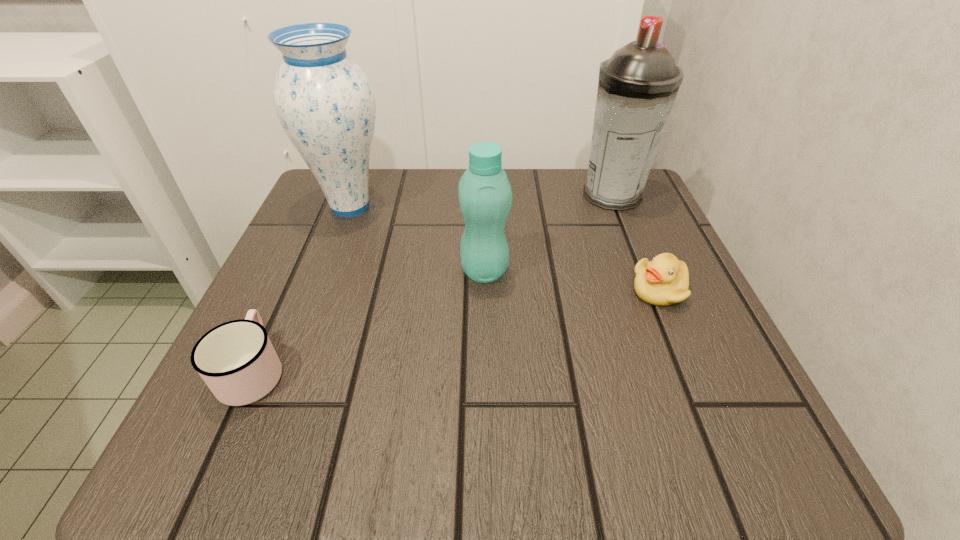
Locate an element on the screen. The width and height of the screenshot is (960, 540). aerosol can positioned at the right edge is located at coordinates (638, 84).

Locate an element on the screen. Image resolution: width=960 pixels, height=540 pixels. duckling positioned at the right edge is located at coordinates (663, 281).

Locate an element on the screen. object located at the far left corner is located at coordinates (325, 103).

Find the location of a particular element. object that is at the near left corner is located at coordinates (237, 361).

You are a GUI agent. You are given a task and a screenshot of the screen. Output one action in this format:
    pyautogui.click(x=<x>, y=<y>)
    Task: Click on the object located at the far right corner
    This screenshot has width=960, height=540.
    Given the screenshot: What is the action you would take?
    638,84

The height and width of the screenshot is (540, 960). I want to click on vacant space at the far edge of the desktop, so click(x=399, y=202).

At what (x,y) coordinates should I click in order to perform the action: click on free space at the near edge. Please return your answer as a coordinate pair (x, y). The width and height of the screenshot is (960, 540). Looking at the image, I should click on (x=373, y=469).

The width and height of the screenshot is (960, 540). In order to click on vacant space at the right edge of the desktop in this screenshot , I will do `click(692, 282)`.

Identify the location of vacant region at the far left corner of the desktop. This screenshot has height=540, width=960. point(329,219).

In the image, there is a desktop. In order to click on free region at the near left corner in this screenshot , I will do `click(195, 436)`.